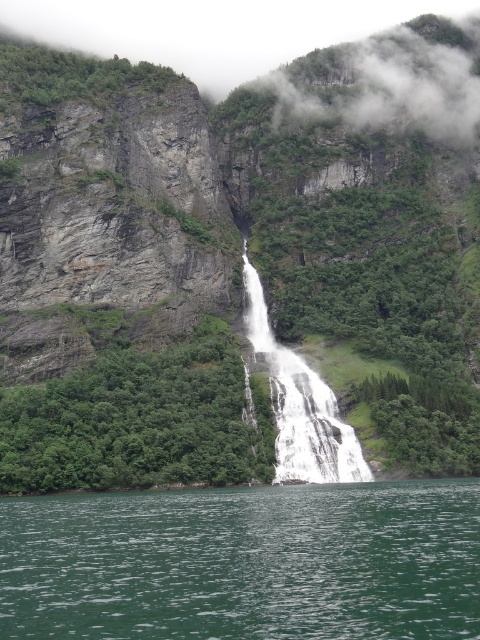
Can you confirm if green liquid water at center is positioned to the right of white smooth waterfall at center?

In fact, green liquid water at center is to the left of white smooth waterfall at center.

Between point (445, 516) and point (317, 426), which one is positioned behind?

Point (317, 426)

Which is behind, point (211, 573) or point (351, 476)?

Positioned behind is point (351, 476).

Identify the location of green liquid water at center. (244, 563).